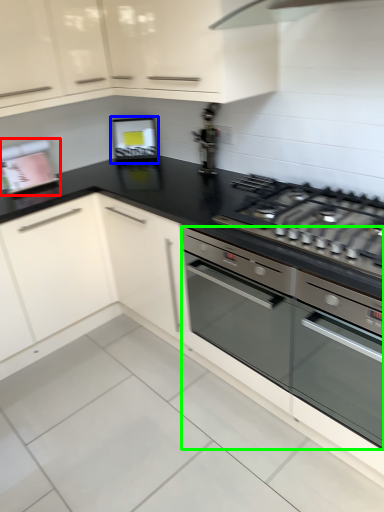
Question: Estimate the real-world distances between objects in this image. Which object is farther from appliance (highlighted by a red box), appliance (highlighted by a blue box) or home appliance (highlighted by a green box)?

Choices:
 (A) appliance
 (B) home appliance

Answer: (B)